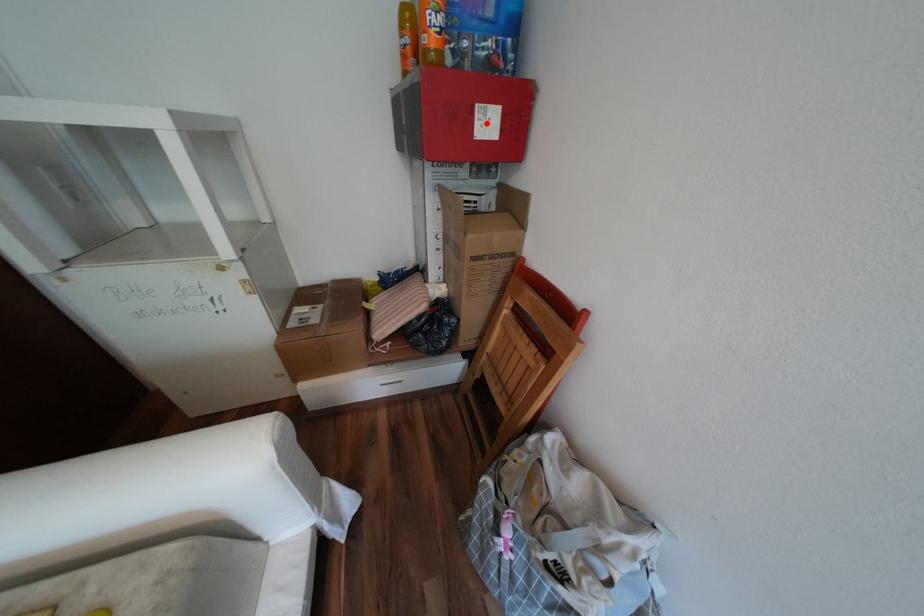
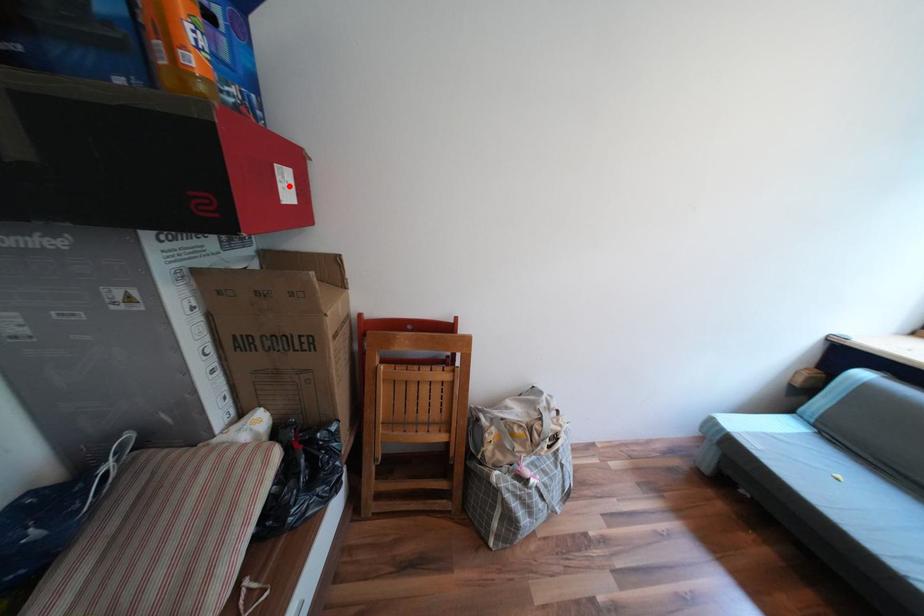
I am providing you with two images of the same scene from different viewpoints. A red point is marked on the first image and another point is marked on the second image. Do the highlighted points in image1 and image2 indicate the same real-world spot?

Yes